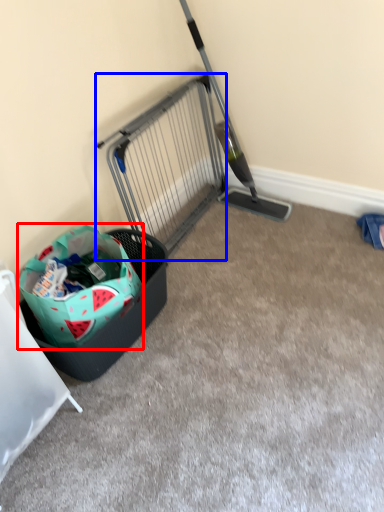
Question: Which object is closer to the camera taking this photo, shopping bag (highlighted by a red box) or cage (highlighted by a blue box)?

Choices:
 (A) shopping bag
 (B) cage

Answer: (A)